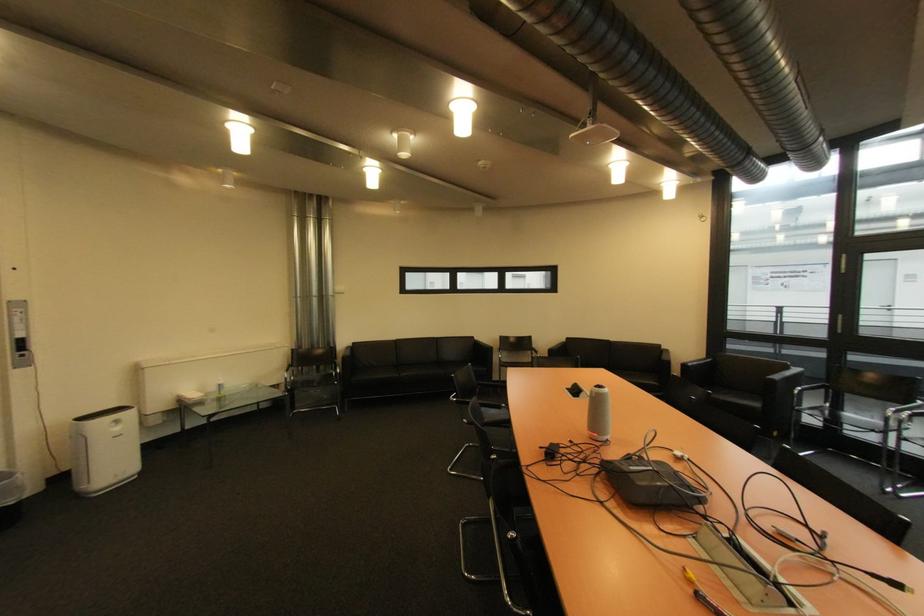
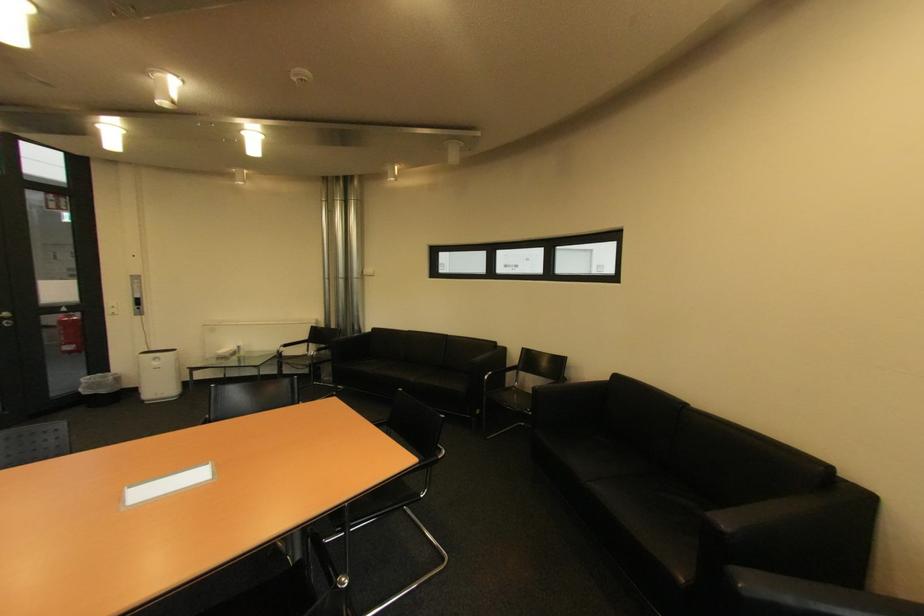
The point at (124, 430) is marked in the first image. Where is the corresponding point in the second image?

(164, 363)